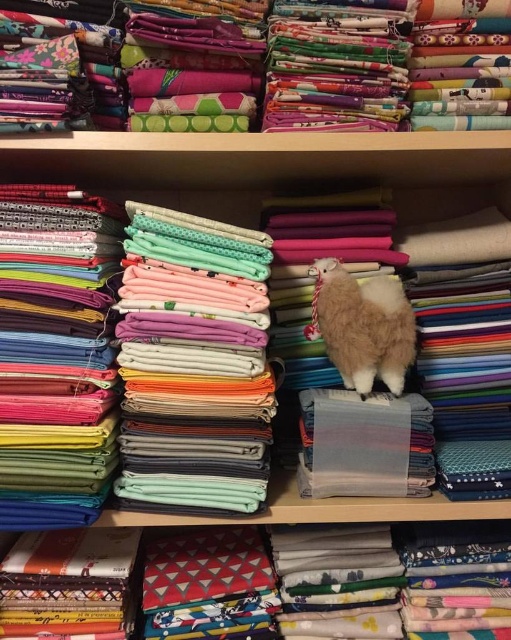
Which is behind, point (160, 483) or point (99, 228)?

Point (160, 483)

Is point (175, 316) farther from viewer compared to point (91, 448)?

Yes, point (175, 316) is farther from viewer.

Is point (220, 340) more distant than point (54, 243)?

That is True.

Where is `smooth cotton fabric at center`? smooth cotton fabric at center is located at coordinates (195, 356).

Does floral fabric at upper center have a lesser height compared to fluffy white alpaca at center?

Yes.

Is floral fabric at upper center in front of fluffy white alpaca at center?

Yes, floral fabric at upper center is closer to the viewer.

Between point (320, 19) and point (383, 333), which one is positioned behind?

The point (383, 333) is more distant.

The image size is (511, 640). In order to click on floral fabric at upper center in this screenshot , I will do `click(316, 65)`.

What do you see at coordinates (57, 355) in the screenshot? Image resolution: width=511 pixels, height=640 pixels. I see `matte green fabric at left` at bounding box center [57, 355].

Between matte green fabric at left and fluffy white alpaca at center, which one is positioned higher?

fluffy white alpaca at center is higher up.

Is point (53, 476) positioned after point (353, 372)?

No, it is not.

This screenshot has width=511, height=640. Find the location of `matte green fabric at left`. matte green fabric at left is located at coordinates (57, 355).